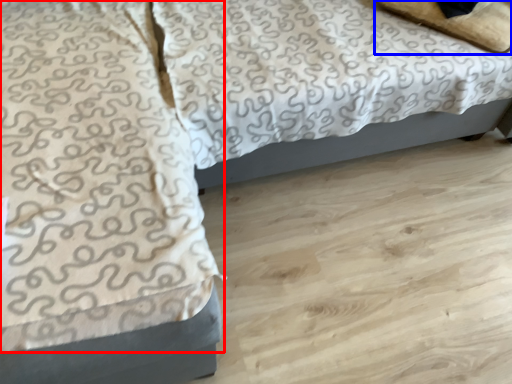
Question: Which object is closer to the camera taking this photo, blanket (highlighted by a red box) or pillow (highlighted by a blue box)?

Choices:
 (A) blanket
 (B) pillow

Answer: (A)